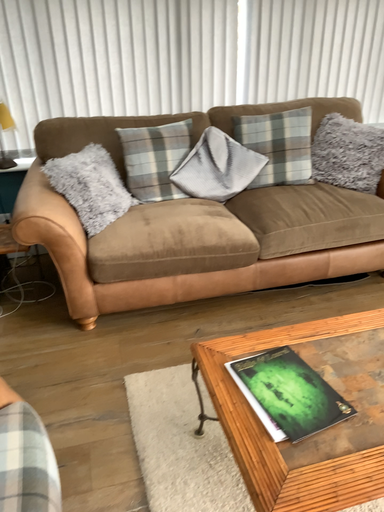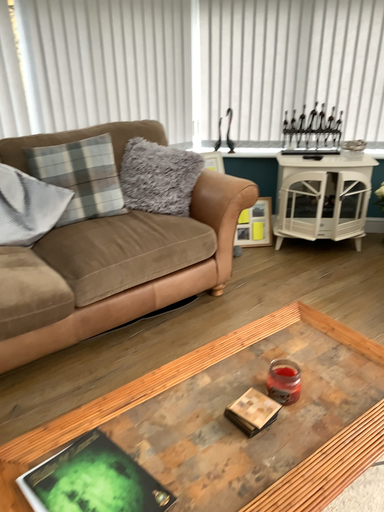
Question: How did the camera likely rotate when shooting the video?

Choices:
 (A) rotated right
 (B) rotated left

Answer: (A)